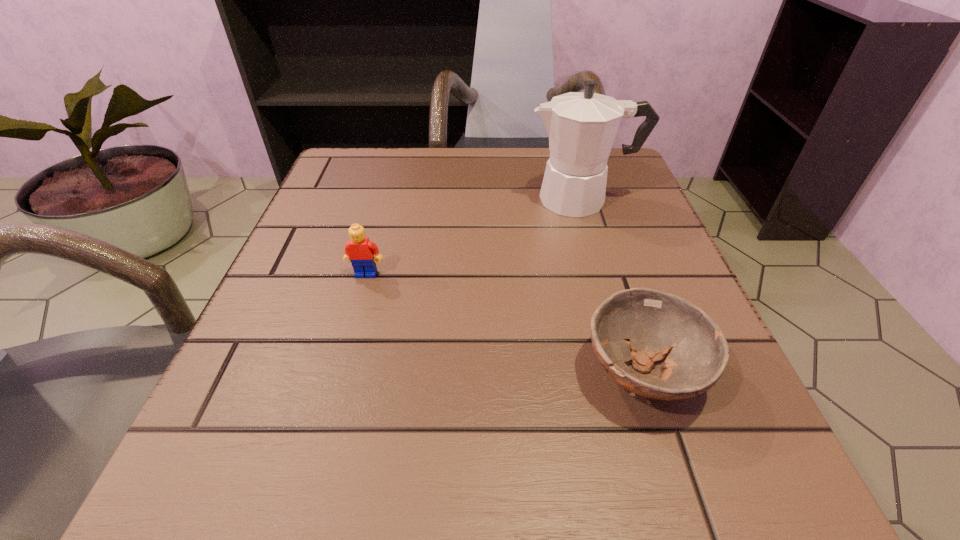
Locate an element on the screen. Image resolution: width=960 pixels, height=540 pixels. empty location between the nearest object and the second nearest object is located at coordinates (504, 323).

At what (x,y) coordinates should I click in order to perform the action: click on free space between the second farthest object and the tallest object. Please return your answer as a coordinate pair (x, y). The width and height of the screenshot is (960, 540). Looking at the image, I should click on (474, 237).

Where is `unoccupied area between the second tallest object and the nearest object`? The image size is (960, 540). unoccupied area between the second tallest object and the nearest object is located at coordinates (504, 323).

At what (x,y) coordinates should I click in order to perform the action: click on free space between the nearest object and the coffeepot. Please return your answer as a coordinate pair (x, y). Looking at the image, I should click on (612, 286).

Point out which object is positioned as the nearest to the coffeepot. Please provide its 2D coordinates. Your answer should be formatted as a tuple, i.e. [(x, y)], where the tuple contains the x and y coordinates of a point satisfying the conditions above.

[(655, 323)]

The image size is (960, 540). What are the coordinates of `object identified as the closest to the leftmost object` in the screenshot? It's located at (581, 126).

Identify the location of free spot that satisfies the following two spatial constraints: 1. on the face of the bowl; 2. on the right side of the second tallest object. This screenshot has height=540, width=960. click(339, 372).

Locate an element on the screen. The image size is (960, 540). free region that satisfies the following two spatial constraints: 1. at the spout of the nearest object; 2. on the right side of the tallest object is located at coordinates (635, 372).

Identify the location of free space in the image that satisfies the following two spatial constraints: 1. at the spout of the tallest object; 2. on the face of the leftmost object. The width and height of the screenshot is (960, 540). (605, 274).

Locate an element on the screen. This screenshot has width=960, height=540. free space that satisfies the following two spatial constraints: 1. on the face of the leftmost object; 2. on the right side of the bowl is located at coordinates (339, 372).